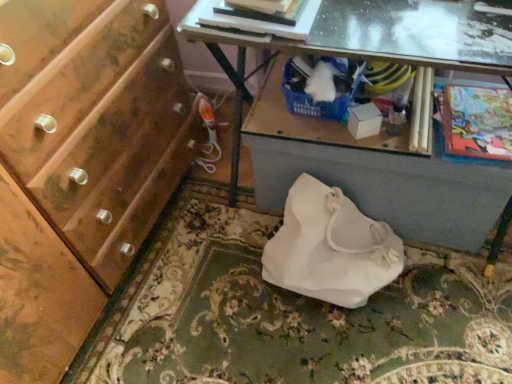
Find the location of a particular element. This screenshot has height=384, width=512. vacant space that is to the left of wooden magazine at right, which is the 2th magazine from left to right is located at coordinates (340, 122).